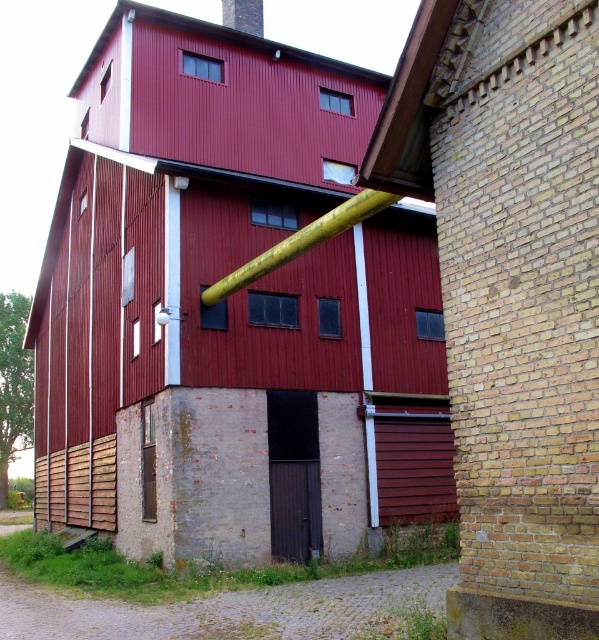
You are a drone operator who needs to fly a drone through the space between the metallic red barn at center and the smooth yellow pipe at upper center. Can you fly the drone horizontally between them?

The metallic red barn at center is below the smooth yellow pipe at upper center, so yes, the drone can fly horizontally between them as there is vertical space available.

You are standing in front of the red corrugated metal barn at center and the smooth yellow pipe at upper center. Which object is positioned to the left?

The smooth yellow pipe at upper center is positioned to the left of the red corrugated metal barn at center.